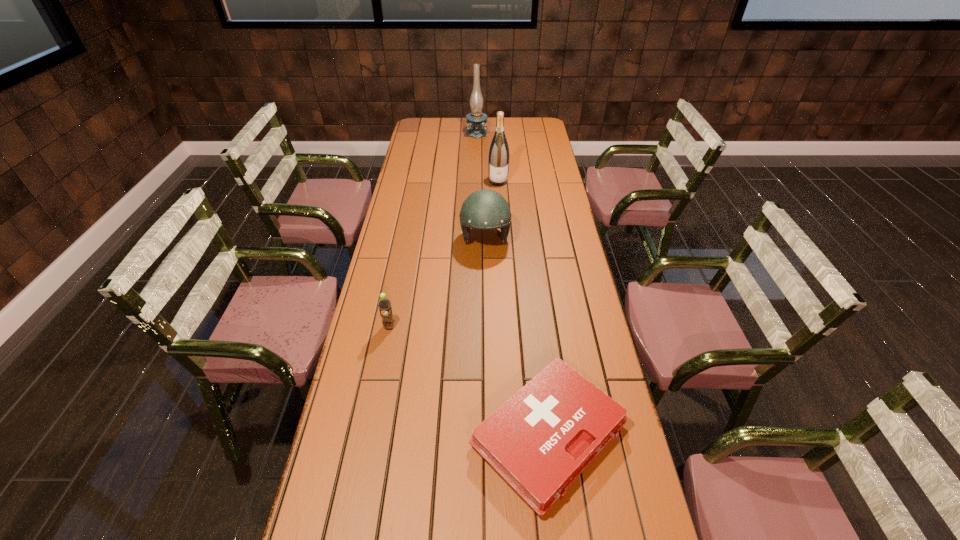
Where is `free point that satisfies the following two spatial constraints: 1. on the label of the wine bottle; 2. on the right side of the nearest object`? Image resolution: width=960 pixels, height=540 pixels. free point that satisfies the following two spatial constraints: 1. on the label of the wine bottle; 2. on the right side of the nearest object is located at coordinates (513, 435).